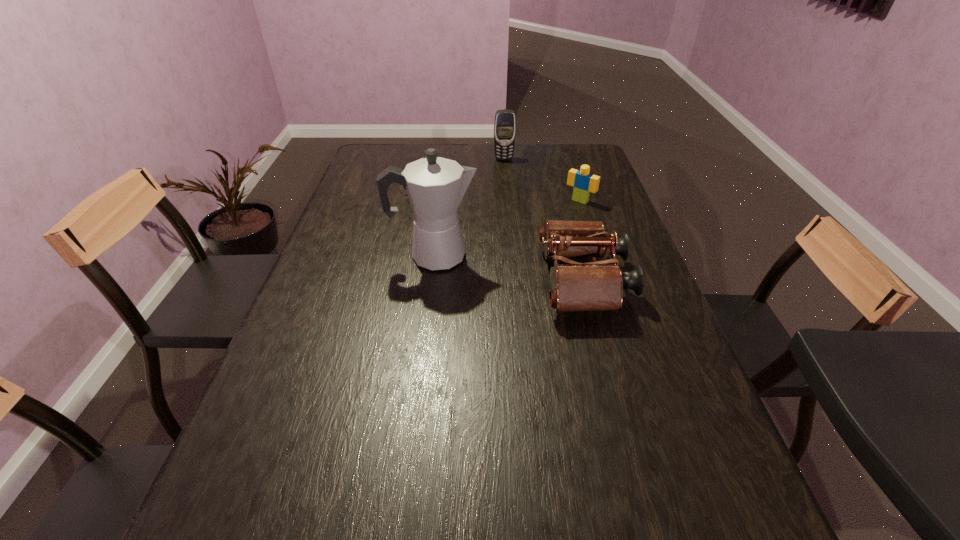
Where is `coffeepot`? The width and height of the screenshot is (960, 540). coffeepot is located at coordinates (435, 186).

Identify the location of binoculars. (598, 285).

Image resolution: width=960 pixels, height=540 pixels. Identify the location of Lego. (584, 182).

Locate an element on the screen. the third farthest object is located at coordinates (584, 182).

Locate an element on the screen. Image resolution: width=960 pixels, height=540 pixels. the fourth nearest object is located at coordinates (386, 167).

The image size is (960, 540). What are the coordinates of `the shortest object` in the screenshot? It's located at (386, 167).

Find the location of a particular element. This screenshot has width=960, height=540. cellular telephone is located at coordinates (505, 120).

Locate an element on the screen. The width and height of the screenshot is (960, 540). the third object from right to left is located at coordinates (505, 120).

The image size is (960, 540). I want to click on vacant space located on the front of the tallest object, so click(417, 393).

What are the coordinates of `vacant region located through the eyepieces of the third shortest object` in the screenshot? It's located at (649, 281).